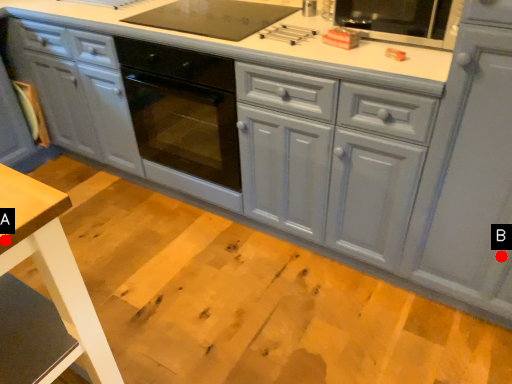
Question: Two points are circled on the image, labeled by A and B beside each circle. Which point appears farthest from the camera in this image?

Choices:
 (A) A is further
 (B) B is further

Answer: (B)